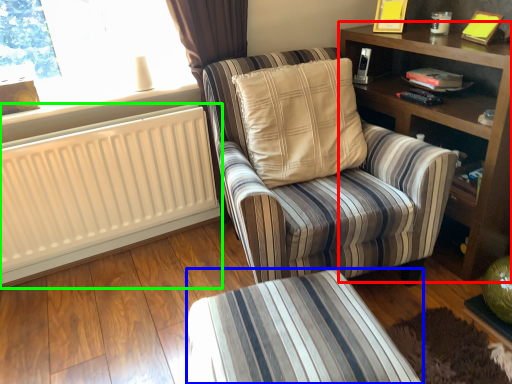
Question: Which object is the closest to the shelf (highlighted by a red box)? Choose among these: table (highlighted by a blue box) or radiator (highlighted by a green box).

Choices:
 (A) table
 (B) radiator

Answer: (A)